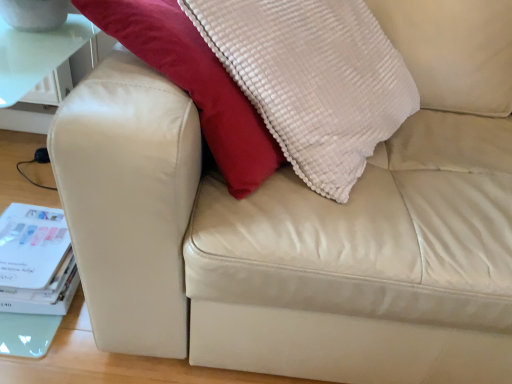
Locate an element on the screen. This screenshot has width=512, height=384. white paper at lower left is located at coordinates (31, 245).

The image size is (512, 384). What do you see at coordinates (31, 245) in the screenshot?
I see `white paper at lower left` at bounding box center [31, 245].

The height and width of the screenshot is (384, 512). Identify the location of white paper at lower left. (31, 245).